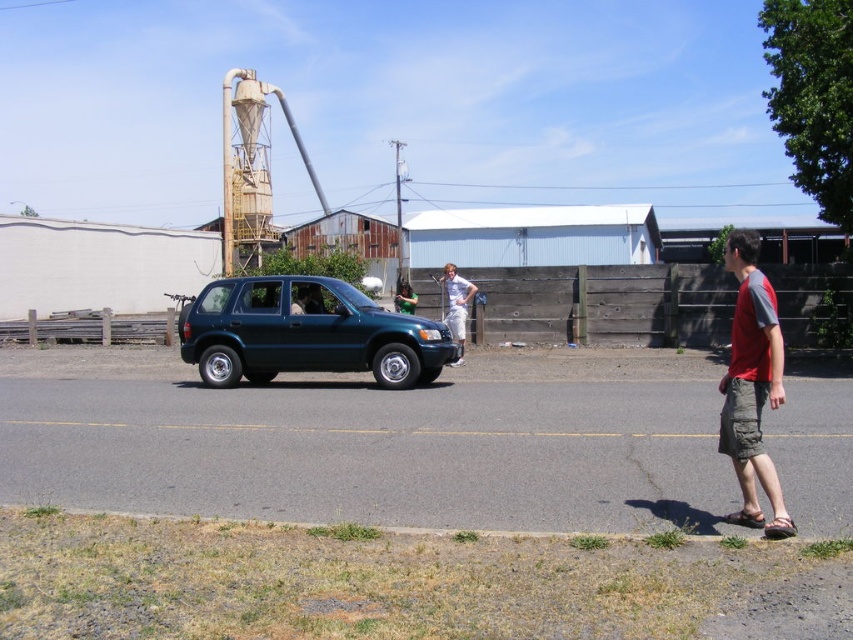
You are a photographer trying to capture both the red cotton shirt at right and the green fabric shirt at center in a single frame. Given their height difference, which shirt will appear larger in the photo?

The red cotton shirt at right is much taller than the green fabric shirt at center, so it will appear larger in the photo.